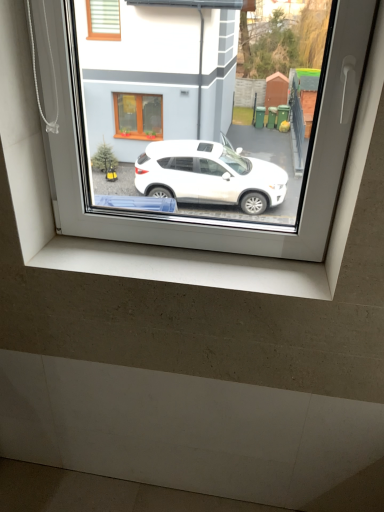
Question: Is transparent glass window at center positioned before white concrete window sill at lower center?

Choices:
 (A) no
 (B) yes

Answer: (B)

Question: Is transparent glass window at center bigger than white concrete window sill at lower center?

Choices:
 (A) no
 (B) yes

Answer: (B)

Question: Can you confirm if transparent glass window at center is wider than white concrete window sill at lower center?

Choices:
 (A) yes
 (B) no

Answer: (B)

Question: Is transparent glass window at center taller than white concrete window sill at lower center?

Choices:
 (A) yes
 (B) no

Answer: (A)

Question: From a real-world perspective, is transparent glass window at center over white concrete window sill at lower center?

Choices:
 (A) no
 (B) yes

Answer: (B)

Question: Is white concrete window sill at lower center a part of transparent glass window at center?

Choices:
 (A) yes
 (B) no

Answer: (B)

Question: Is white concrete window sill at lower center located outside transparent glass window at center?

Choices:
 (A) yes
 (B) no

Answer: (A)

Question: Can you confirm if white concrete window sill at lower center is bigger than transparent glass window at center?

Choices:
 (A) yes
 (B) no

Answer: (B)

Question: Does white concrete window sill at lower center lie behind transparent glass window at center?

Choices:
 (A) no
 (B) yes

Answer: (B)

Question: Can you confirm if white concrete window sill at lower center is shorter than transparent glass window at center?

Choices:
 (A) yes
 (B) no

Answer: (A)

Question: From a real-world perspective, is white concrete window sill at lower center over transparent glass window at center?

Choices:
 (A) yes
 (B) no

Answer: (B)

Question: Is white concrete window sill at lower center not close to transparent glass window at center?

Choices:
 (A) no
 (B) yes

Answer: (A)

Question: Considering their positions, is white concrete window sill at lower center located in front of or behind transparent glass window at center?

Choices:
 (A) front
 (B) behind

Answer: (B)